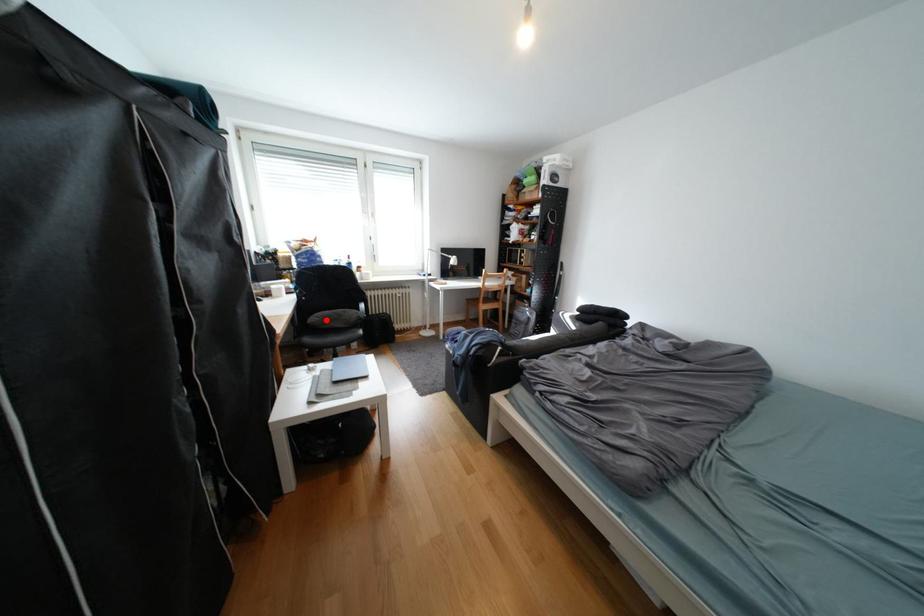
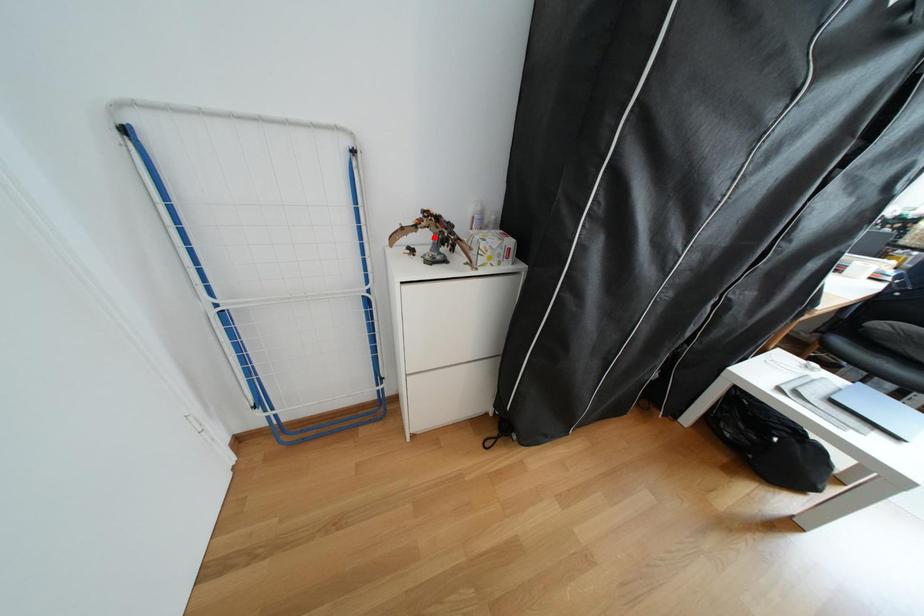
I am providing you with two images of the same scene from different viewpoints. A red point is marked on the first image and another point is marked on the second image. Are the points marked in image1 and image2 representing the same 3D position?

No